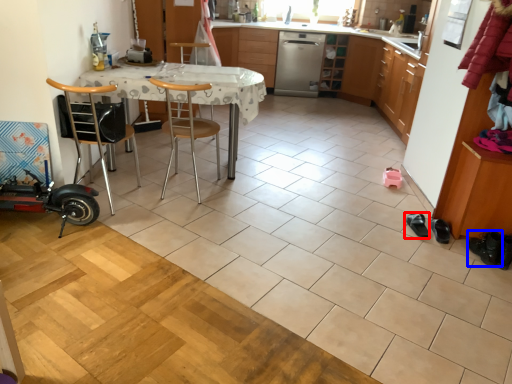
Question: Which of the following is the farthest to the observer, footwear (highlighted by a red box) or footwear (highlighted by a blue box)?

Choices:
 (A) footwear
 (B) footwear

Answer: (A)